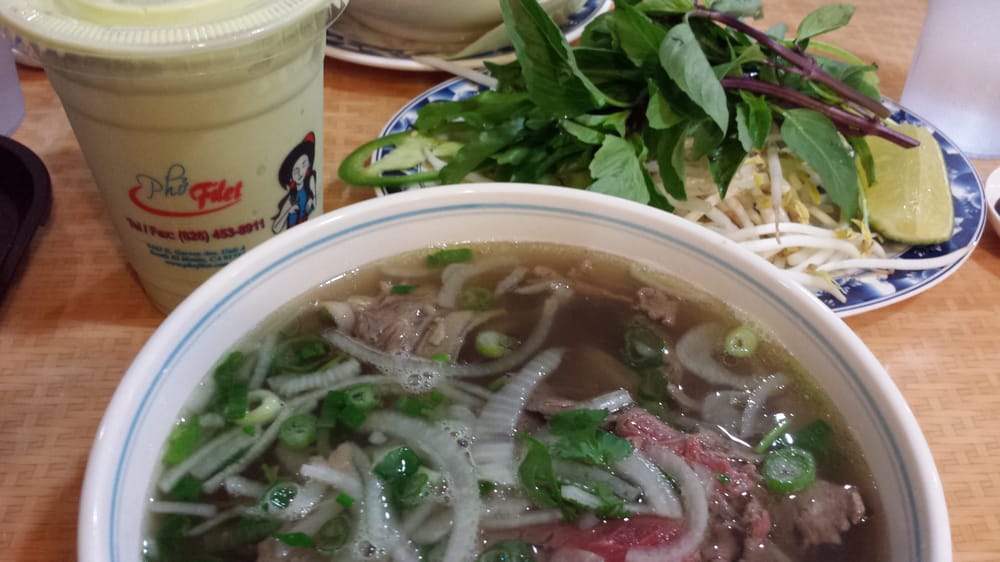
Identify the location of bowl of soup. (568, 423).